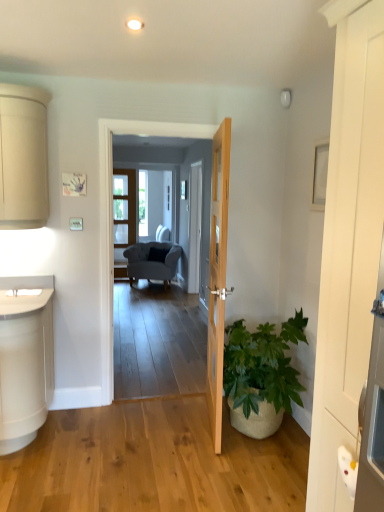
This screenshot has width=384, height=512. I want to click on free space in front of natural wood door at center, which ranks as the first door in back-to-front order, so click(x=196, y=461).